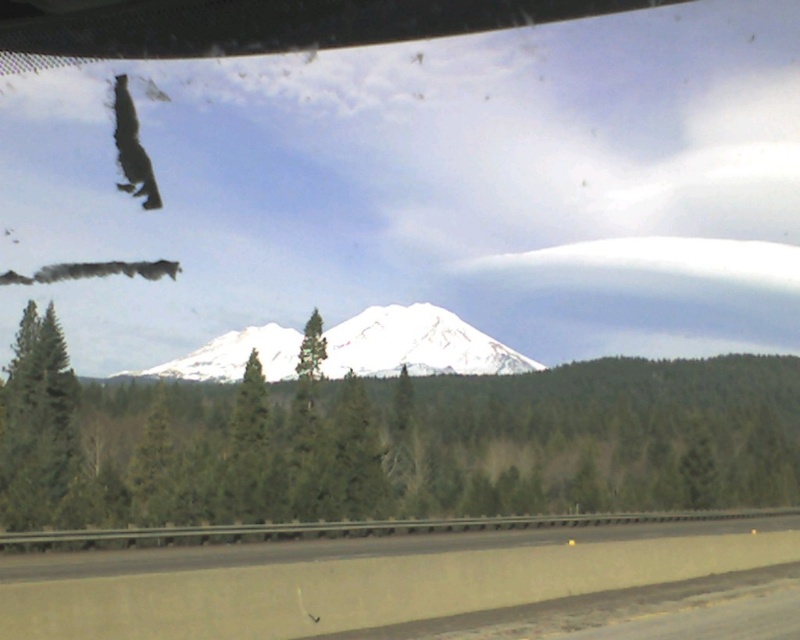
In the scene shown: You are a passenger in a car driving through a snowy mountain region. You look out the window and see a point marked at coordinates (x=416, y=344). What natural feature is located at that point?

The point at coordinates (x=416, y=344) is where the white snow covered mountain at center is located.